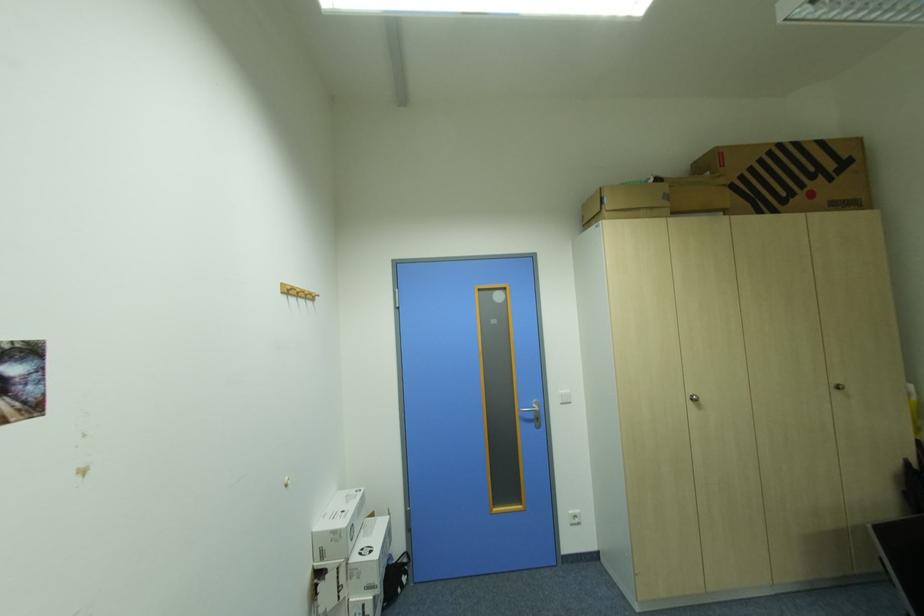
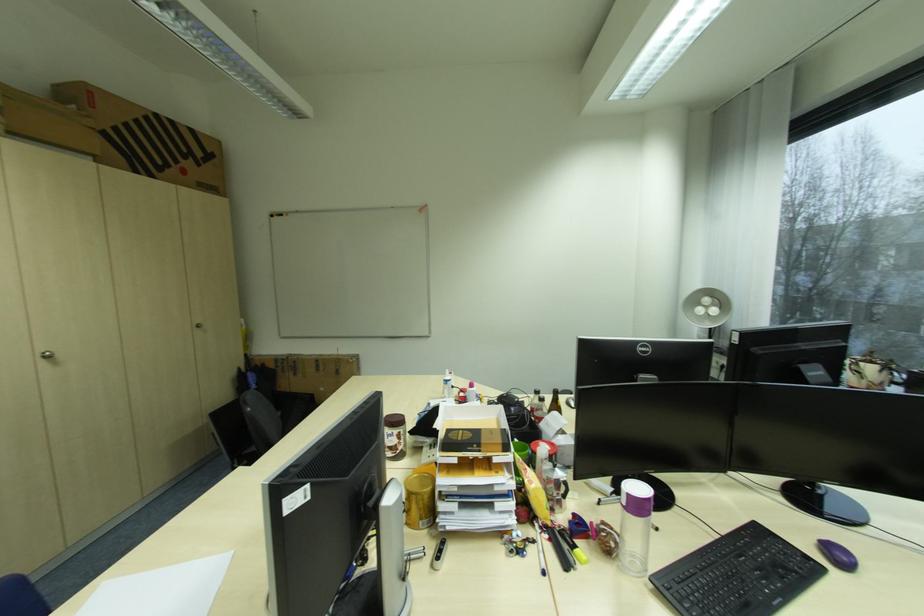
Question: The images are taken continuously from a first-person perspective. In which direction is your viewpoint rotating?

Choices:
 (A) Left
 (B) Right
 (C) Up
 (D) Down

Answer: (B)